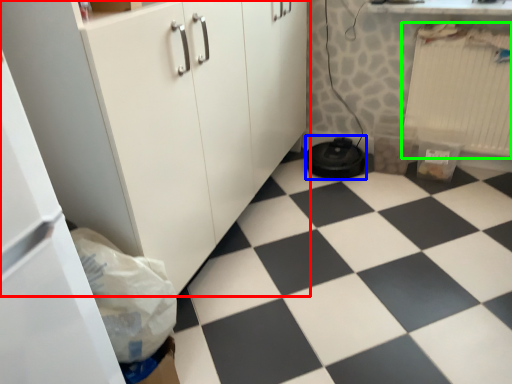
Question: Which object is the farthest from cabinetry (highlighted by a red box)? Choose among these: water heater (highlighted by a blue box) or radiator (highlighted by a green box).

Choices:
 (A) water heater
 (B) radiator

Answer: (B)